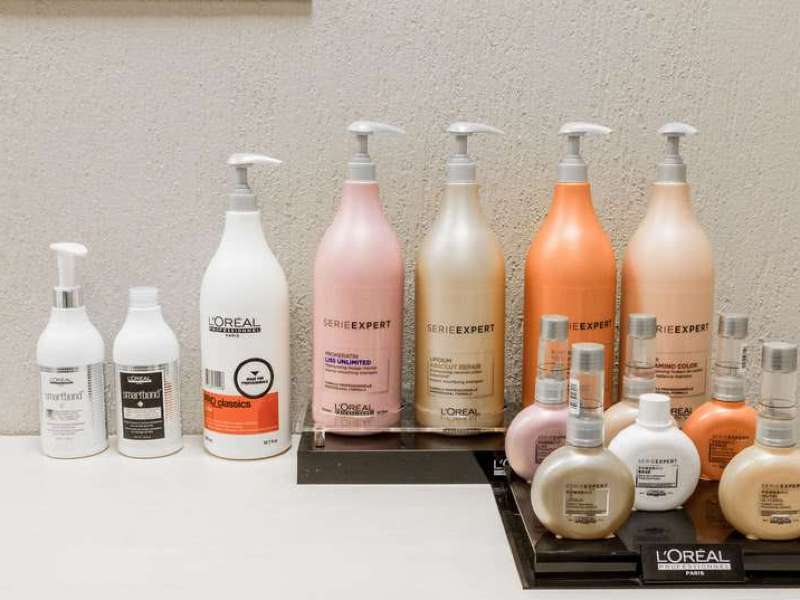
Identify the location of pump dispensers. The image size is (800, 600). (254, 264), (364, 250), (470, 250), (582, 250), (666, 235), (65, 343).